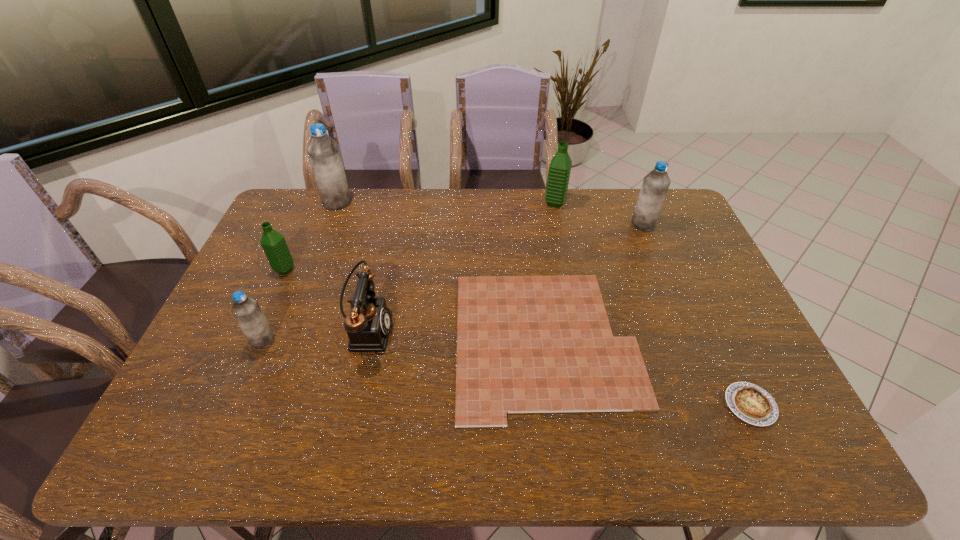
In order to click on the tallest water bottle in this screenshot , I will do `click(323, 152)`.

The image size is (960, 540). What are the coordinates of `the biggest blue water bottle` in the screenshot? It's located at (323, 152).

The width and height of the screenshot is (960, 540). Identify the location of the second water bottle from right to left. (560, 166).

Identify the location of the right green water bottle. The width and height of the screenshot is (960, 540). (560, 166).

Where is `the second biggest blue water bottle`? This screenshot has width=960, height=540. the second biggest blue water bottle is located at coordinates (656, 183).

The image size is (960, 540). Identify the location of the rightmost water bottle. (656, 183).

This screenshot has height=540, width=960. Find the location of `the fifth object from right to left`. the fifth object from right to left is located at coordinates (368, 325).

Identify the location of telephone. The height and width of the screenshot is (540, 960). (368, 325).

Where is `the smallest blue water bottle`? Image resolution: width=960 pixels, height=540 pixels. the smallest blue water bottle is located at coordinates click(x=246, y=310).

Identify the location of the nearest water bottle. (246, 310).